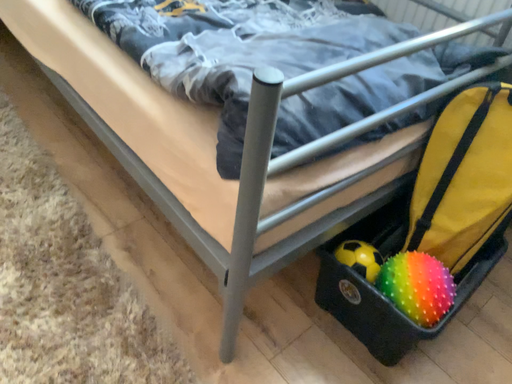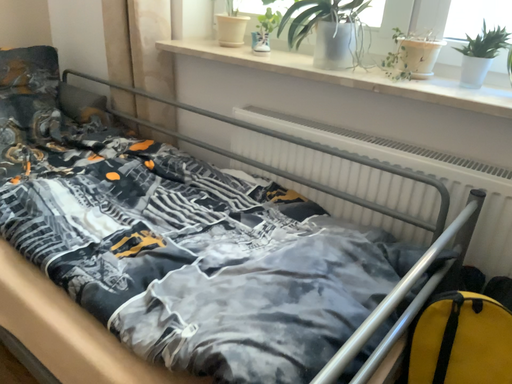
Question: Which way did the camera rotate in the video?

Choices:
 (A) rotated upward
 (B) rotated downward

Answer: (A)